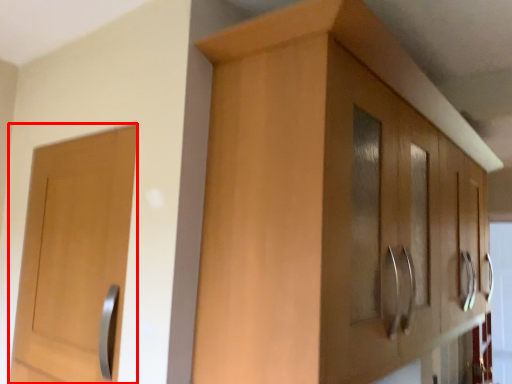
Question: In this image, where is door (annotated by the red box) located relative to cabinetry?

Choices:
 (A) left
 (B) right

Answer: (A)